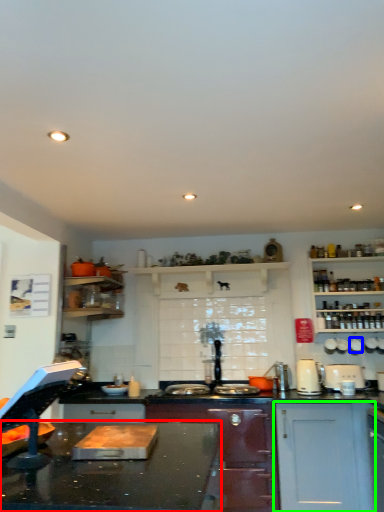
Question: Considering the real-world distances, which object is farthest from countertop (highlighted by a red box)? appliance (highlighted by a blue box) or cabinetry (highlighted by a green box)?

Choices:
 (A) appliance
 (B) cabinetry

Answer: (A)